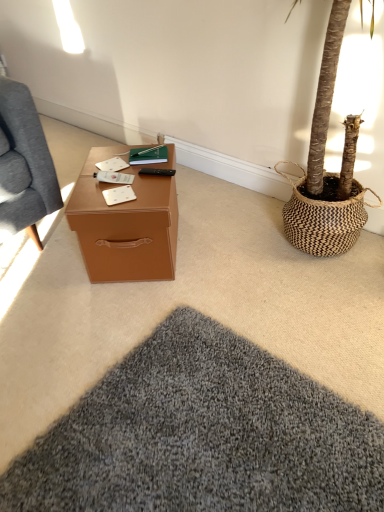
The image size is (384, 512). What are the coordinates of `vacant position to the left of white matte notepad at center` in the screenshot? It's located at (86, 196).